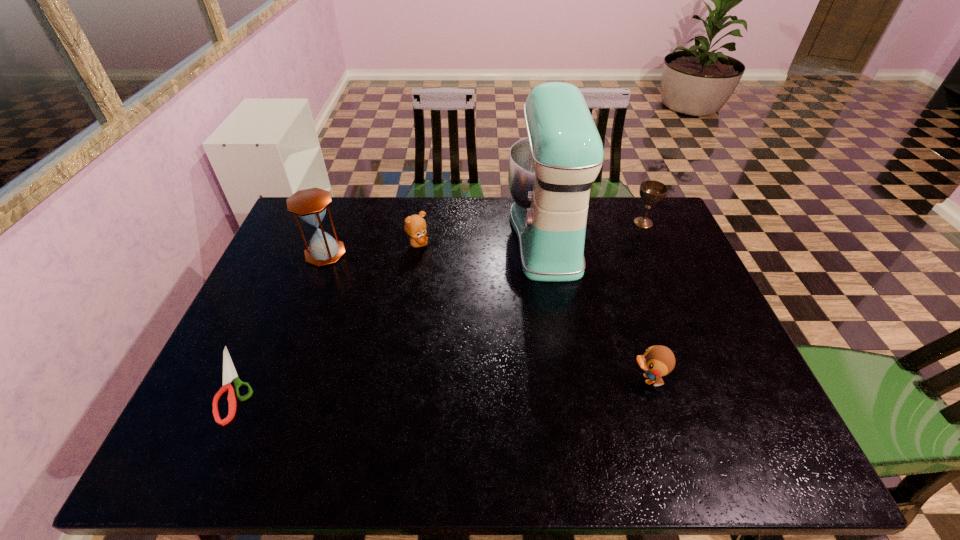
I want to click on chalice that is positioned at the far edge, so click(x=651, y=191).

Where is `teddy bear at the far edge`? teddy bear at the far edge is located at coordinates (415, 226).

You are a GUI agent. You are given a task and a screenshot of the screen. Output one action in this format:
    pyautogui.click(x=<x>, y=<y>)
    Task: Click on the hourglass present at the left edge
    
    Given the screenshot: What is the action you would take?
    pyautogui.click(x=310, y=205)

Locate an element on the screen. Image resolution: width=960 pixels, height=540 pixels. scissors that is at the left edge is located at coordinates (229, 373).

Where is `object situated at the right edge`? The width and height of the screenshot is (960, 540). object situated at the right edge is located at coordinates (651, 191).

Identify the location of object at the far left corner. The image size is (960, 540). (310, 205).

Where is `object situated at the far right corner`? The image size is (960, 540). object situated at the far right corner is located at coordinates (651, 191).

The image size is (960, 540). What are the coordinates of `free space at the far edge of the desktop` in the screenshot? It's located at (364, 204).

Locate an element on the screen. This screenshot has height=540, width=960. free spot at the near edge of the desktop is located at coordinates (706, 457).

The image size is (960, 540). What are the coordinates of `vacant space at the left edge of the desktop` in the screenshot? It's located at (260, 384).